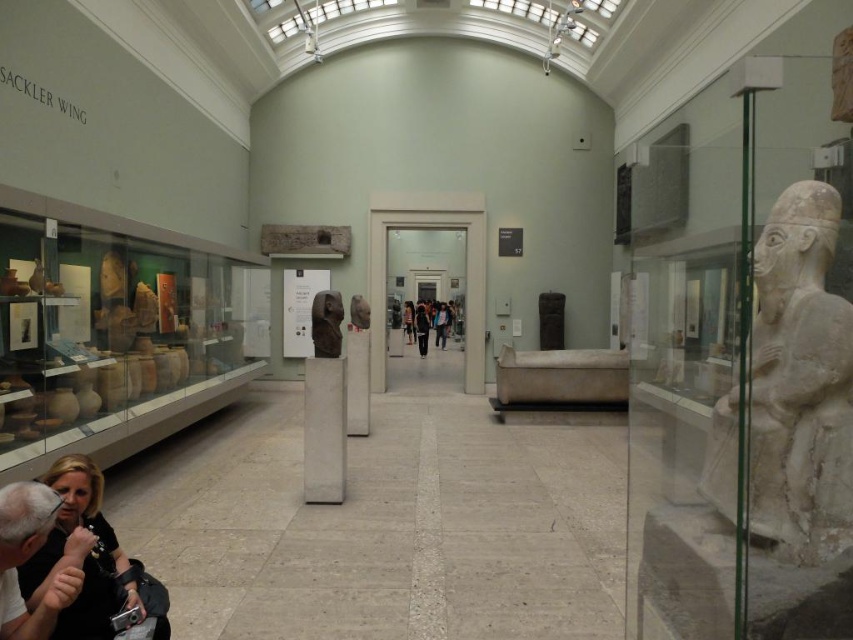
You are standing in the museum gallery and want to take a photo of both the point at coordinates point (71, 528) and point (363, 314). Since you want both points to be in focus, which point should you focus on first to ensure the other is also in focus?

You should focus on point (363, 314) first because it is farther from the camera than point (71, 528). By focusing on the farther point, the closer point will also be within the depth of field, ensuring both are in focus.

You are a visitor standing in the Sackler Wing of the museum. You want to take a photo of the matte stone statue at center without moving closer than 2 meters for safety. Can you take the photo from your current position?

The matte stone statue at center is 5.70 meters away from the viewer. Since the minimum safe distance is 2 meters, you can take the photo from your current position as you are already 5.70 meters away, which is beyond the 2 meter requirement.

You are standing at the entrance of the Sackler Wing and want to locate the white marble statue at right. According to the coordinate system where the bottom left corner is the origin, can you determine if the statue is closer to the right wall or the ceiling?

The white marble statue at right is located at coordinate point 0.611 on the x axis and 0.928 on the y axis. Since the y coordinate is closer to 1, which represents the ceiling, the statue is closer to the ceiling.